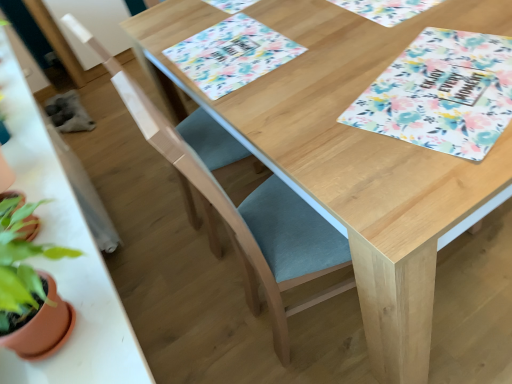
Identify the location of free space behind floral fabric placemat at upper right. The width and height of the screenshot is (512, 384). (368, 41).